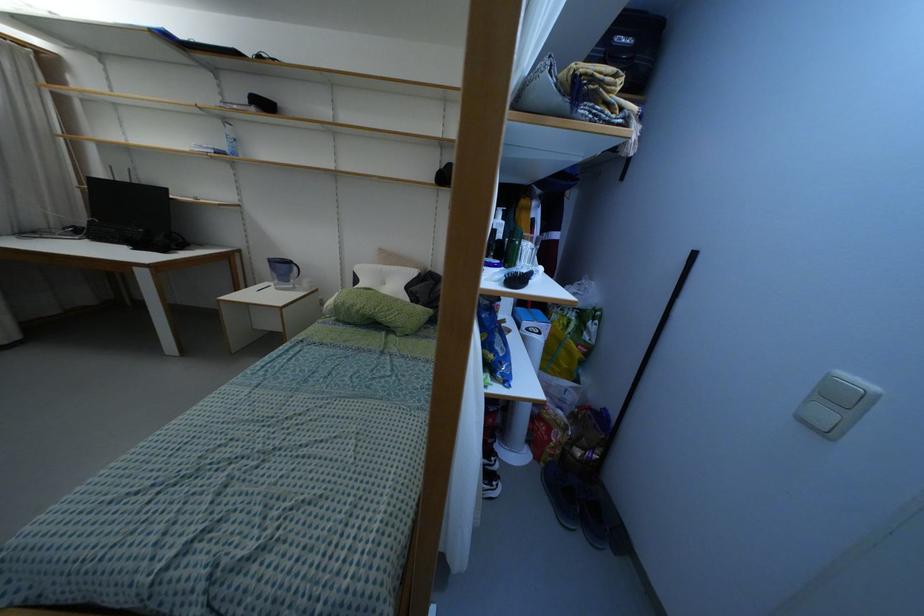
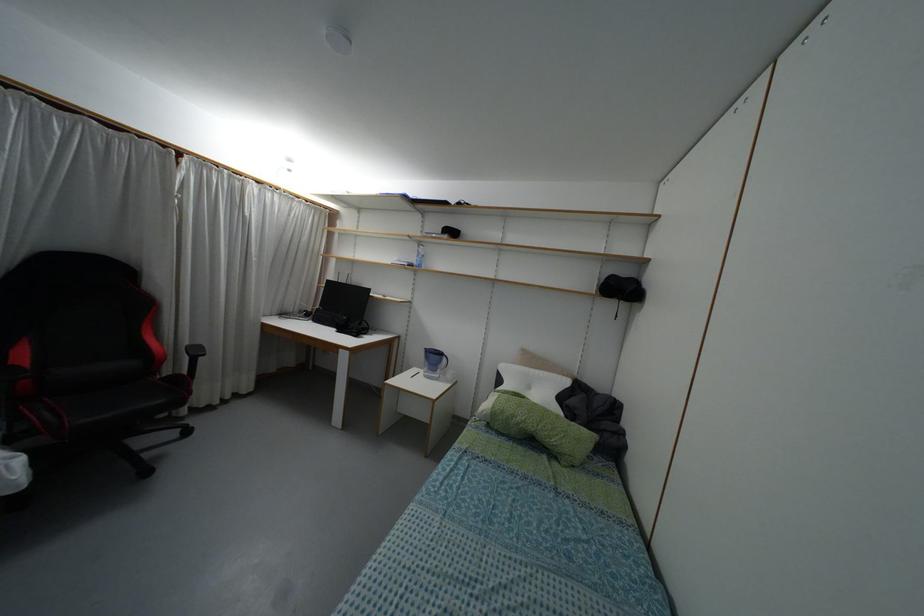
Question: Which direction would the cameraman need to move to produce the second image? Reply with the corresponding letter.

Choices:
 (A) Left
 (B) Right
 (C) Forward
 (D) Backward

Answer: (A)